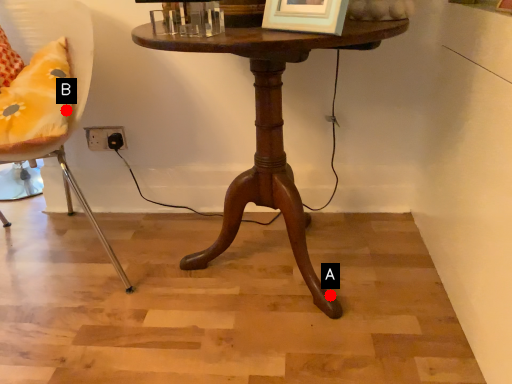
Question: Two points are circled on the image, labeled by A and B beside each circle. Which point appears closest to the camera in this image?

Choices:
 (A) A is closer
 (B) B is closer

Answer: (B)